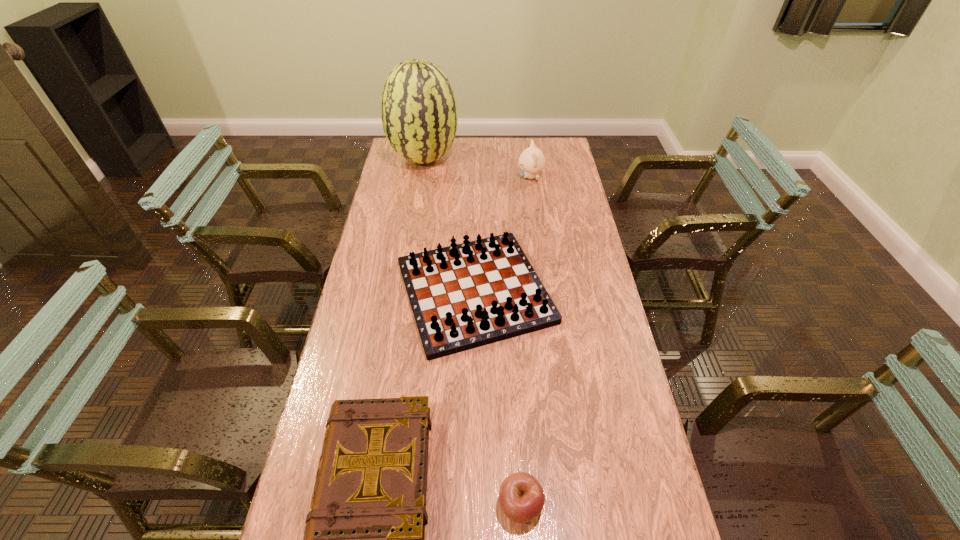
This screenshot has width=960, height=540. I want to click on object that is at the far edge, so click(419, 114).

The height and width of the screenshot is (540, 960). I want to click on watermelon that is at the left edge, so click(419, 114).

Locate an element on the screen. chessboard positioned at the left edge is located at coordinates (463, 296).

Image resolution: width=960 pixels, height=540 pixels. I want to click on kitten positioned at the right edge, so click(531, 161).

Where is `chessboard that is at the right edge`? This screenshot has width=960, height=540. chessboard that is at the right edge is located at coordinates (463, 296).

I want to click on object at the far left corner, so click(x=419, y=114).

This screenshot has width=960, height=540. In order to click on vacant region at the far edge of the desktop in this screenshot , I will do `click(487, 158)`.

In the image, there is a desktop. Where is `vacant space at the left edge`? This screenshot has height=540, width=960. vacant space at the left edge is located at coordinates (404, 172).

Where is `free region at the right edge of the desktop`? This screenshot has width=960, height=540. free region at the right edge of the desktop is located at coordinates (545, 202).

Image resolution: width=960 pixels, height=540 pixels. Identify the location of vacant space at the far left corner of the desktop. (397, 158).